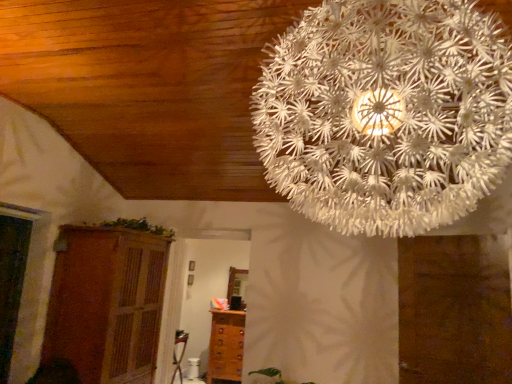
Question: Is wooden cupboard at lower left looking in the opposite direction of brown wooden chest of drawers at lower center?

Choices:
 (A) yes
 (B) no

Answer: (B)

Question: Does wooden cupboard at lower left come in front of brown wooden chest of drawers at lower center?

Choices:
 (A) no
 (B) yes

Answer: (B)

Question: Does wooden cupboard at lower left have a lesser height compared to brown wooden chest of drawers at lower center?

Choices:
 (A) no
 (B) yes

Answer: (A)

Question: Is wooden cupboard at lower left beside brown wooden chest of drawers at lower center?

Choices:
 (A) no
 (B) yes

Answer: (A)

Question: Considering the relative sizes of wooden cupboard at lower left and brown wooden chest of drawers at lower center in the image provided, is wooden cupboard at lower left thinner than brown wooden chest of drawers at lower center?

Choices:
 (A) no
 (B) yes

Answer: (A)

Question: Is wooden cupboard at lower left smaller than brown wooden chest of drawers at lower center?

Choices:
 (A) no
 (B) yes

Answer: (A)

Question: Is white paper-like at upper center smaller than green leafy plant at upper center?

Choices:
 (A) no
 (B) yes

Answer: (A)

Question: Considering the relative positions of white paper-like at upper center and green leafy plant at upper center in the image provided, is white paper-like at upper center to the right of green leafy plant at upper center from the viewer's perspective?

Choices:
 (A) no
 (B) yes

Answer: (B)

Question: Considering the relative sizes of white paper-like at upper center and green leafy plant at upper center in the image provided, is white paper-like at upper center shorter than green leafy plant at upper center?

Choices:
 (A) yes
 (B) no

Answer: (B)

Question: From the image's perspective, does white paper-like at upper center appear lower than green leafy plant at upper center?

Choices:
 (A) no
 (B) yes

Answer: (A)

Question: Does white paper-like at upper center contain green leafy plant at upper center?

Choices:
 (A) no
 (B) yes

Answer: (A)

Question: Is there a large distance between white paper-like at upper center and green leafy plant at upper center?

Choices:
 (A) no
 (B) yes

Answer: (B)

Question: Is wooden cupboard at lower left outside white paper-like at upper center?

Choices:
 (A) yes
 (B) no

Answer: (A)